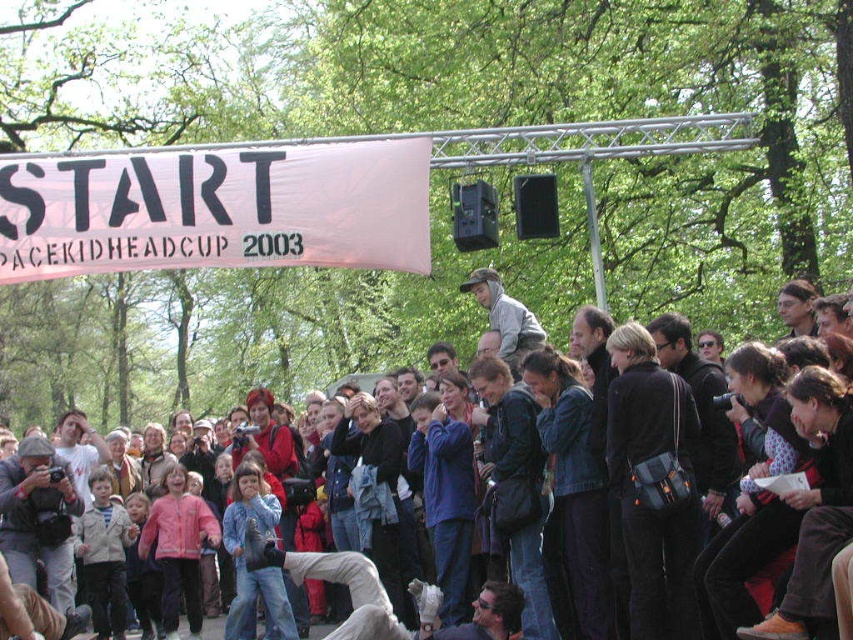
Question: Which object is closer to the camera taking this photo?

Choices:
 (A) matte black jacket at center
 (B) gray fabric jacket at lower left
 (C) blue denim jacket at center

Answer: (C)

Question: Which point is farther to the camera?

Choices:
 (A) gray hoodie at center
 (B) white fabric banner at upper center

Answer: (A)

Question: Which of the following is the farthest from the observer?

Choices:
 (A) pos(4,524)
 (B) pos(790,320)

Answer: (A)

Question: Can you confirm if white fabric banner at upper center is positioned to the left of gray fabric jacket at lower left?

Choices:
 (A) yes
 (B) no

Answer: (B)

Question: Is gray fabric jacket at lower left in front of matte black jacket at center?

Choices:
 (A) yes
 (B) no

Answer: (A)

Question: Is gray fabric jacket at lower left positioned before gray hoodie at center?

Choices:
 (A) yes
 (B) no

Answer: (A)